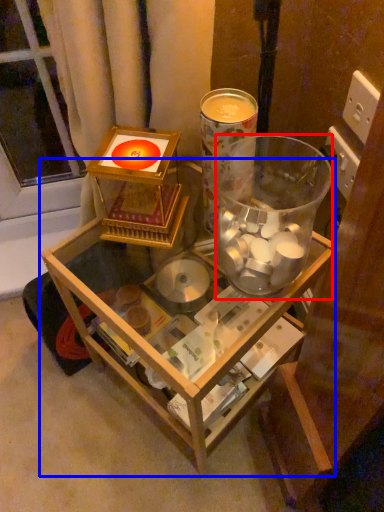
Question: Which object appears closest to the camera in this image, beverage (highlighted by a red box) or table (highlighted by a blue box)?

Choices:
 (A) beverage
 (B) table

Answer: (A)